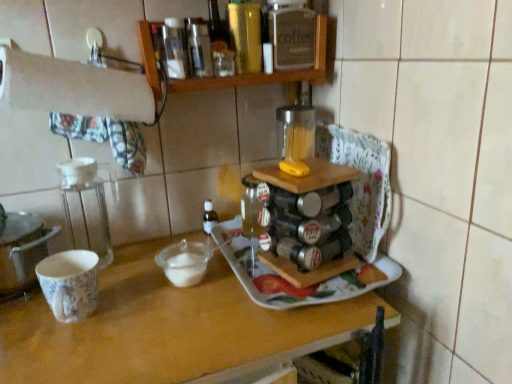
At what (x,y) coordinates should I click in order to perform the action: click on vacant space in between porcelain floral mug at left and white ceramic tray at center. Please return your answer as a coordinate pair (x, y). Looking at the image, I should click on (161, 300).